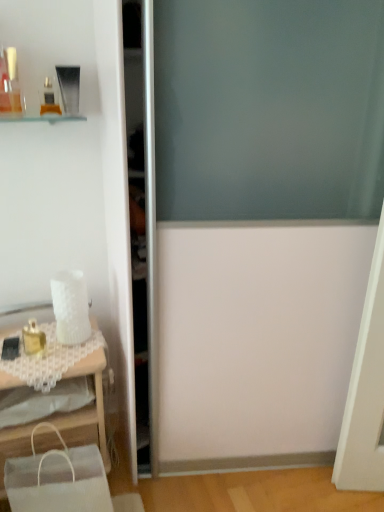
Question: Is white lace table at lower left oriented towards transparent glass screen door at center?

Choices:
 (A) yes
 (B) no

Answer: (B)

Question: Does white lace table at lower left have a lesser width compared to transparent glass screen door at center?

Choices:
 (A) no
 (B) yes

Answer: (B)

Question: Is white lace table at lower left further to camera compared to transparent glass screen door at center?

Choices:
 (A) yes
 (B) no

Answer: (A)

Question: From a real-world perspective, does white lace table at lower left stand above transparent glass screen door at center?

Choices:
 (A) yes
 (B) no

Answer: (B)

Question: From the image's perspective, is white lace table at lower left below transparent glass screen door at center?

Choices:
 (A) yes
 (B) no

Answer: (A)

Question: Does white lace table at lower left have a greater height compared to transparent glass screen door at center?

Choices:
 (A) yes
 (B) no

Answer: (B)

Question: From the image's perspective, does transparent glass screen door at center appear lower than matte gold compact at upper left, which ranks as the 2th toiletry in bottom-to-top order?

Choices:
 (A) yes
 (B) no

Answer: (A)

Question: From the image's perspective, is transparent glass screen door at center above matte gold compact at upper left, which ranks as the 2th toiletry in bottom-to-top order?

Choices:
 (A) no
 (B) yes

Answer: (A)

Question: Does transparent glass screen door at center come behind matte gold compact at upper left, which ranks as the 2th toiletry in bottom-to-top order?

Choices:
 (A) no
 (B) yes

Answer: (A)

Question: Can you confirm if transparent glass screen door at center is positioned to the left of matte gold compact at upper left, which ranks as the second toiletry in top-to-bottom order?

Choices:
 (A) no
 (B) yes

Answer: (A)

Question: Is transparent glass screen door at center in front of matte gold compact at upper left, which ranks as the 2th toiletry in bottom-to-top order?

Choices:
 (A) yes
 (B) no

Answer: (A)

Question: Considering the relative sizes of transparent glass screen door at center and matte gold compact at upper left, which ranks as the 2th toiletry in bottom-to-top order, in the image provided, is transparent glass screen door at center shorter than matte gold compact at upper left, which ranks as the 2th toiletry in bottom-to-top order,?

Choices:
 (A) no
 (B) yes

Answer: (A)

Question: Is matte gold compact at upper left, which ranks as the 2th toiletry in bottom-to-top order, located outside matte glass perfume bottle at upper left, the 3th toiletry positioned from the bottom?

Choices:
 (A) no
 (B) yes

Answer: (B)